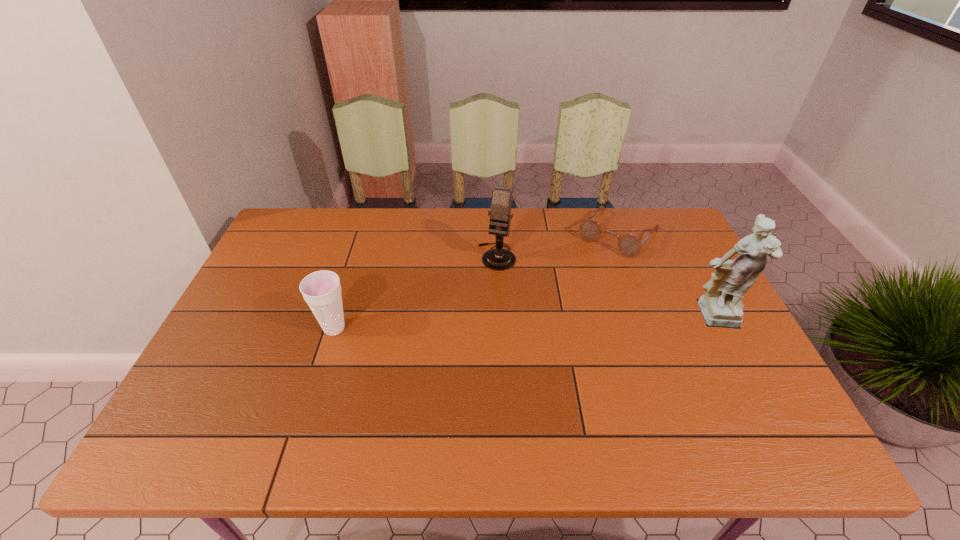
This screenshot has height=540, width=960. I want to click on free space between the shortest object and the leftmost object, so click(476, 281).

Locate an element on the screen. Image resolution: width=960 pixels, height=540 pixels. unoccupied position between the second object from left to right and the tallest object is located at coordinates (606, 287).

Image resolution: width=960 pixels, height=540 pixels. Find the location of `free space between the third tallest object and the second tallest object`. free space between the third tallest object and the second tallest object is located at coordinates click(x=416, y=292).

Identify the location of empty location between the second object from left to right and the cup. The image size is (960, 540). (416, 292).

Where is `the third closest object to the cup`? The height and width of the screenshot is (540, 960). the third closest object to the cup is located at coordinates (721, 306).

Where is `object that can be found as the closest to the figurine`? Image resolution: width=960 pixels, height=540 pixels. object that can be found as the closest to the figurine is located at coordinates (629, 245).

Image resolution: width=960 pixels, height=540 pixels. Find the location of `vacant space that satisfies the following two spatial constraints: 1. on the back side of the third tallest object; 2. on the left side of the shortest object`. vacant space that satisfies the following two spatial constraints: 1. on the back side of the third tallest object; 2. on the left side of the shortest object is located at coordinates (364, 233).

The height and width of the screenshot is (540, 960). I want to click on free space that satisfies the following two spatial constraints: 1. on the back side of the spectacles; 2. on the left side of the cup, so click(x=364, y=233).

At what (x,y) coordinates should I click in order to perform the action: click on vacant space that satisfies the following two spatial constraints: 1. on the back side of the leftmost object; 2. on the right side of the third object from right to left. Please return your answer as a coordinate pair (x, y). Image resolution: width=960 pixels, height=540 pixels. Looking at the image, I should click on (357, 256).